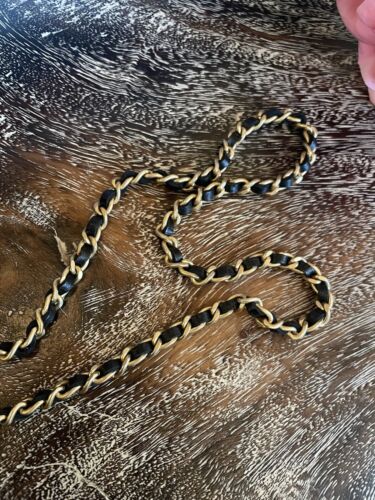
This screenshot has height=500, width=375. What are the coordinates of `white crack in table` in the screenshot? It's located at (36, 467), (59, 466), (83, 480), (100, 491).